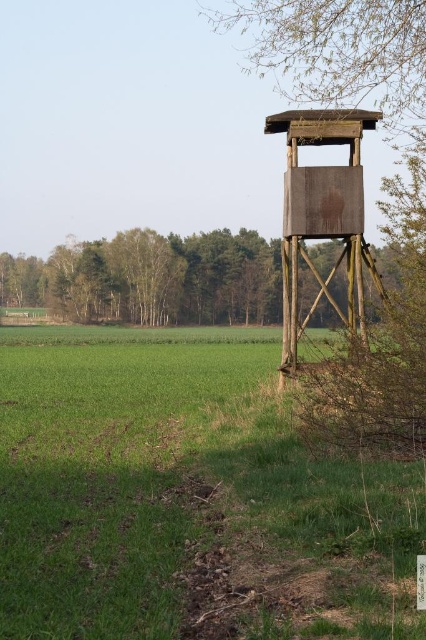
Looking at this image, you are a farmer checking your field and see the green grass at lower left and the brown wooden tower at upper right. Which object is positioned to the left of the other?

The green grass at lower left is to the left of the brown wooden tower at upper right.